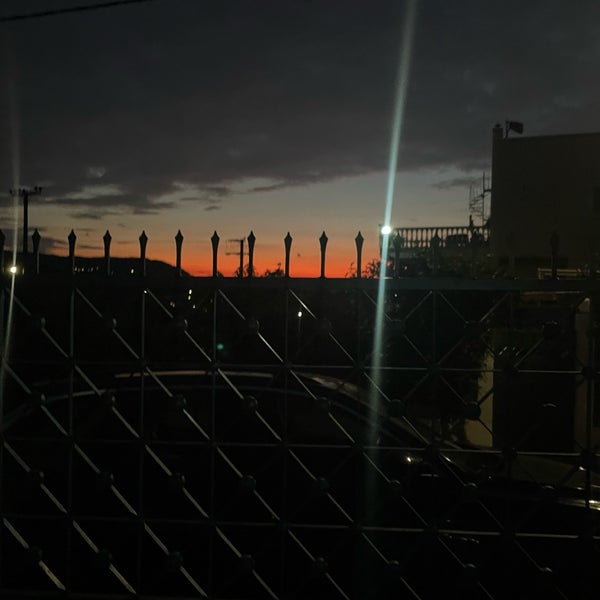
I want to click on artificial light, so click(387, 233), click(12, 271).